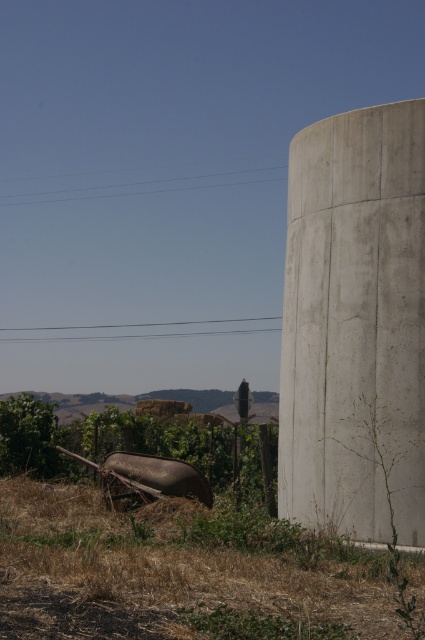
Which is more to the right, concrete at right or dry grass at right?

dry grass at right

Between point (404, 451) and point (367, 451), which one is positioned in front?

Point (404, 451) is in front.

Consider the image. Who is more distant from viewer, (322, 124) or (374, 468)?

Point (322, 124)

I want to click on concrete at right, so click(x=354, y=324).

Which is more to the right, brown rusted wheelbarrow at lower left or concrete at right?

From the viewer's perspective, concrete at right appears more on the right side.

Is point (6, 512) positioned after point (359, 257)?

Yes, it is behind point (359, 257).

Find the location of a particular element. This screenshot has width=425, height=640. brown rusted wheelbarrow at lower left is located at coordinates (170, 548).

This screenshot has height=640, width=425. Find the location of `brown rusted wheelbarrow at lower left`. brown rusted wheelbarrow at lower left is located at coordinates (170, 548).

Is brown rusted wheelbarrow at lower left behind dry grass at right?

No.

Is point (76, 604) positioned after point (396, 609)?

Yes.

I want to click on brown rusted wheelbarrow at lower left, so click(x=170, y=548).